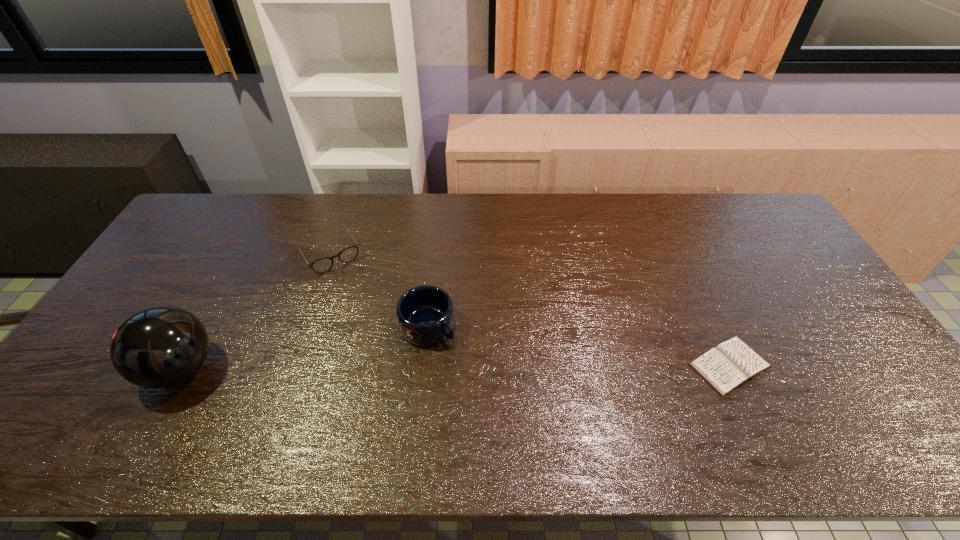
I want to click on free space located 0.230m on the back of the shortest object, so click(x=689, y=276).

Find the location of a particular element. The image size is (960, 540). blank area located through the lenses of the second object from left to right is located at coordinates (363, 305).

Identify the location of free space located through the lenses of the second object from left to right. (391, 347).

This screenshot has height=540, width=960. I want to click on free space located 0.390m through the lenses of the second object from left to right, so click(399, 360).

Identify the location of vacant space located 0.230m with the handle on the side of the mug. (x=515, y=392).

Locate an element on the screen. free location located 0.220m with the handle on the side of the mug is located at coordinates pos(511,389).

You are a GUI agent. You are given a task and a screenshot of the screen. Output one action in this format:
    pyautogui.click(x=<x>, y=<y>)
    Task: Click on the vacant region located 0.070m with the handle on the side of the mug
    
    Given the screenshot: What is the action you would take?
    pyautogui.click(x=467, y=355)

In order to click on object present at the far edge in this screenshot , I will do `click(322, 265)`.

Locate an element on the screen. This screenshot has width=960, height=540. bowling ball located at the near edge is located at coordinates (158, 347).

Identify the location of diary at the near edge. This screenshot has width=960, height=540. (725, 367).